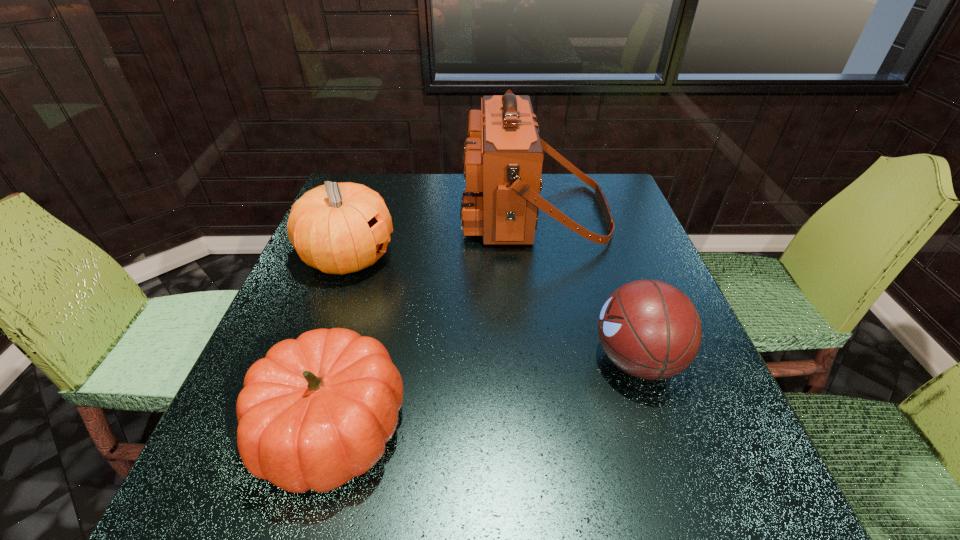
Identify the location of unoccupied position between the nearer pumpkin and the satchel. (433, 320).

Where is `free area in between the tallest object and the farther pumpkin`? The width and height of the screenshot is (960, 540). free area in between the tallest object and the farther pumpkin is located at coordinates (442, 235).

Find the location of a particular element. This screenshot has width=960, height=540. object that is the third closest one to the basketball is located at coordinates (338, 228).

Select which object appears as the second closest to the basketball. Please provide its 2D coordinates. Your answer should be formatted as a tuple, i.e. [(x, y)], where the tuple contains the x and y coordinates of a point satisfying the conditions above.

[(317, 411)]

Identify the location of vacant area in the image that satisfies the following two spatial constraints: 1. on the front-facing side of the basketball; 2. on the right side of the taller pumpkin. (312, 360).

I want to click on vacant space that satisfies the following two spatial constraints: 1. on the front-facing side of the taller pumpkin; 2. on the back side of the basketball, so click(x=312, y=360).

Where is `vacant area in the image that satisfies the following two spatial constraints: 1. on the face side of the satchel; 2. on the back side of the basketball`? Image resolution: width=960 pixels, height=540 pixels. vacant area in the image that satisfies the following two spatial constraints: 1. on the face side of the satchel; 2. on the back side of the basketball is located at coordinates (559, 360).

You are a GUI agent. You are given a task and a screenshot of the screen. Output one action in this format:
    pyautogui.click(x=<x>, y=<y>)
    Task: Click on the vacant space that satisfies the following two spatial constraints: 1. on the face side of the tallest object; 2. on the left side of the basketball
    
    Given the screenshot: What is the action you would take?
    tap(559, 360)

The width and height of the screenshot is (960, 540). I want to click on free space that satisfies the following two spatial constraints: 1. on the back side of the basketball; 2. on the front-facing side of the taller pumpkin, so click(x=603, y=258).

Where is `vacant space that satisfies the following two spatial constraints: 1. on the back side of the basketball; 2. on the front-facing side of the second tallest object`? vacant space that satisfies the following two spatial constraints: 1. on the back side of the basketball; 2. on the front-facing side of the second tallest object is located at coordinates (603, 258).